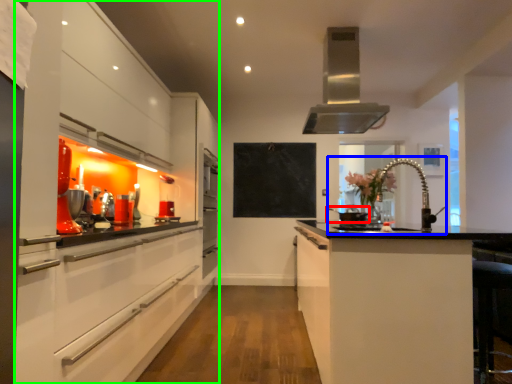
Question: Which object is the closest to the appliance (highlighted by a red box)? Choose among these: sink (highlighted by a blue box) or cabinetry (highlighted by a green box).

Choices:
 (A) sink
 (B) cabinetry

Answer: (A)